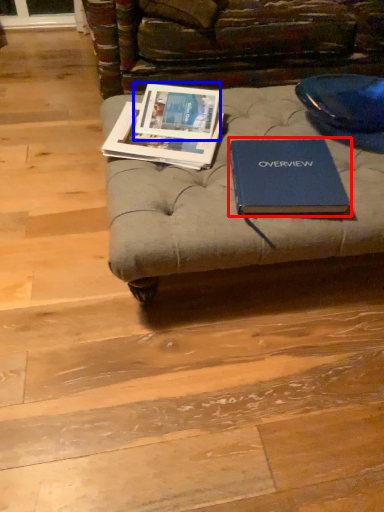
Question: Which object appears farthest to the camera in this image, book (highlighted by a red box) or book cover (highlighted by a blue box)?

Choices:
 (A) book
 (B) book cover

Answer: (B)